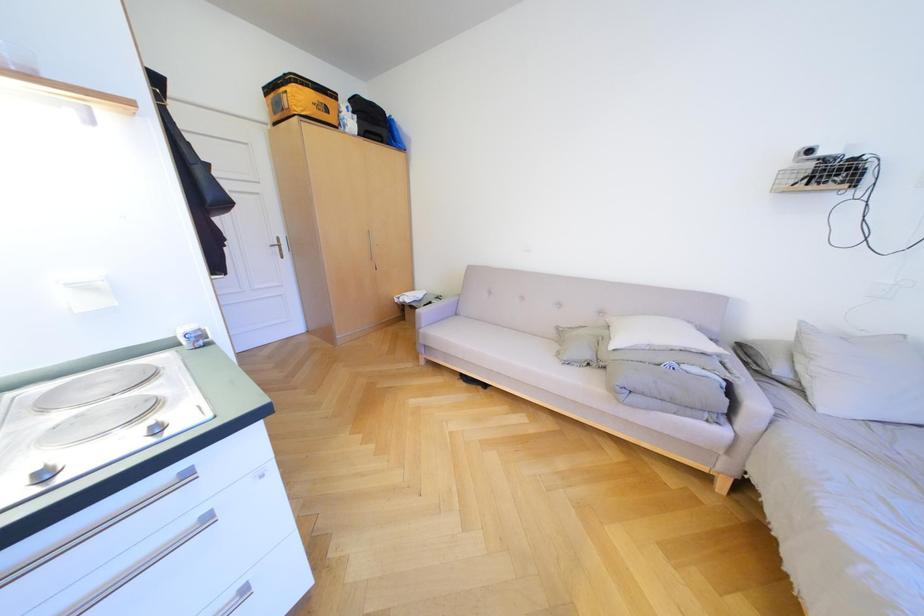
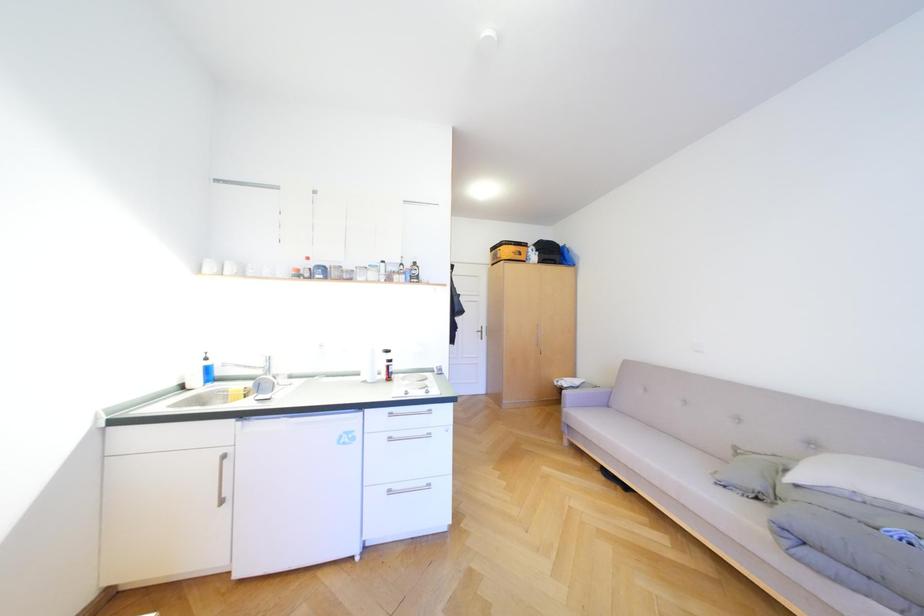
First-person continuous shooting, in which direction is the camera rotating?

The camera's rotation is toward left-up.